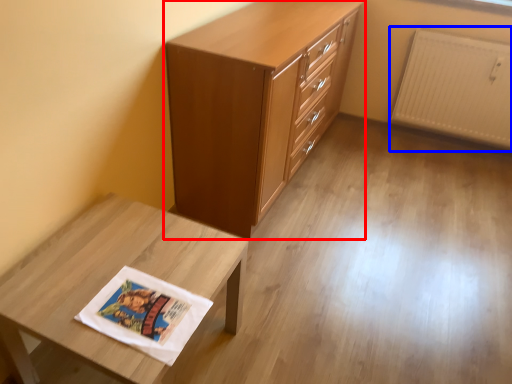
Question: Which of the following is the closest to the observer, chest of drawers (highlighted by a red box) or radiator (highlighted by a blue box)?

Choices:
 (A) chest of drawers
 (B) radiator

Answer: (A)